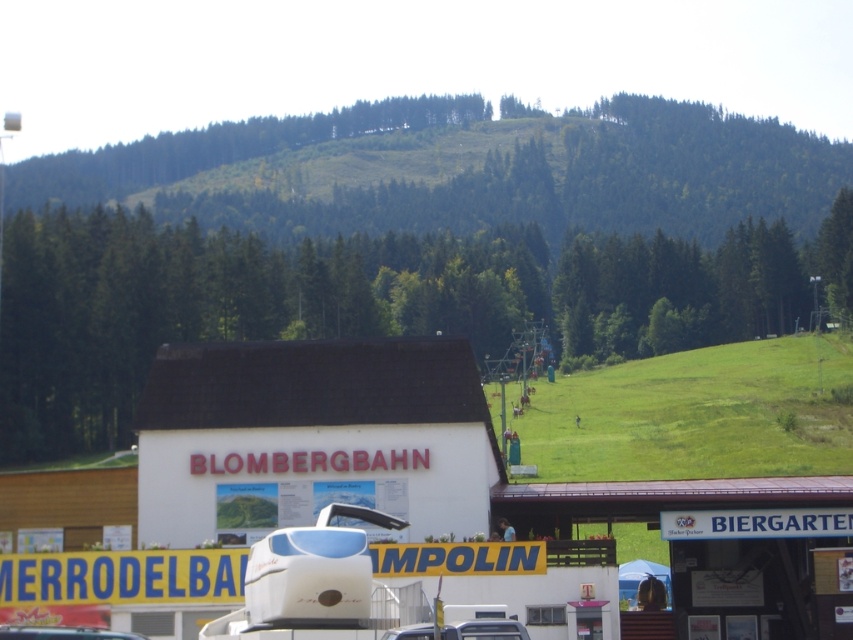
You are a visitor standing in front of the white wooden building at lower right and want to take a photo of the metallic silver car at center. Since the building is taller, will it block your view of the car?

The white wooden building at lower right is much taller than the metallic silver car at center, so it might block your view of the car depending on the angle and distance.